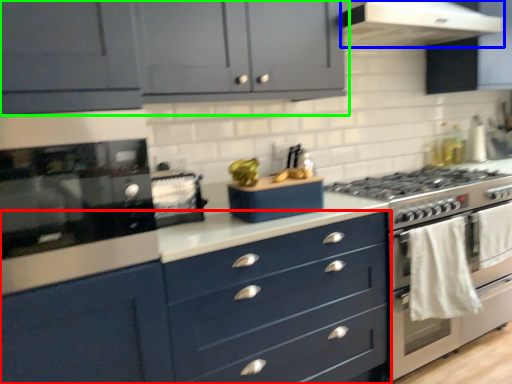
Question: Based on their relative distances, which object is farther from chest of drawers (highlighted by a red box)? Choose from home appliance (highlighted by a blue box) and cabinetry (highlighted by a green box).

Choices:
 (A) home appliance
 (B) cabinetry

Answer: (A)